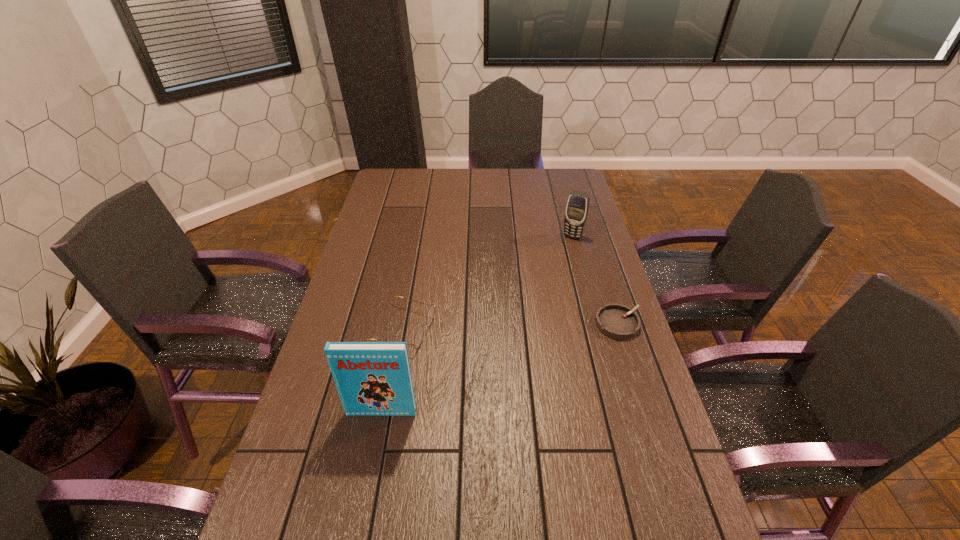
Find the location of `book`. book is located at coordinates (372, 378).

Image resolution: width=960 pixels, height=540 pixels. I want to click on the nearest object, so click(372, 378).

The image size is (960, 540). In order to click on the shortest object in this screenshot , I will do `click(616, 321)`.

I want to click on spectacles, so click(x=418, y=338).

You are a GUI agent. You are given a task and a screenshot of the screen. Output one action in this format:
    pyautogui.click(x=<x>, y=<y>)
    Task: Click on the farthest object
    
    Given the screenshot: What is the action you would take?
    pyautogui.click(x=577, y=207)

Where is `the third shortest object`? Image resolution: width=960 pixels, height=540 pixels. the third shortest object is located at coordinates (577, 207).

This screenshot has height=540, width=960. Find the location of `vacant space located on the front cover of the book`. vacant space located on the front cover of the book is located at coordinates (364, 505).

Where is `free space located on the front of the ashtray`? This screenshot has height=540, width=960. free space located on the front of the ashtray is located at coordinates (634, 371).

Where is `vacant space located 0.340m on the temples of the spectacles`? This screenshot has width=960, height=540. vacant space located 0.340m on the temples of the spectacles is located at coordinates (548, 361).

Locate an element on the screen. The height and width of the screenshot is (540, 960). vacant space located 0.060m on the temples of the spectacles is located at coordinates point(452,339).